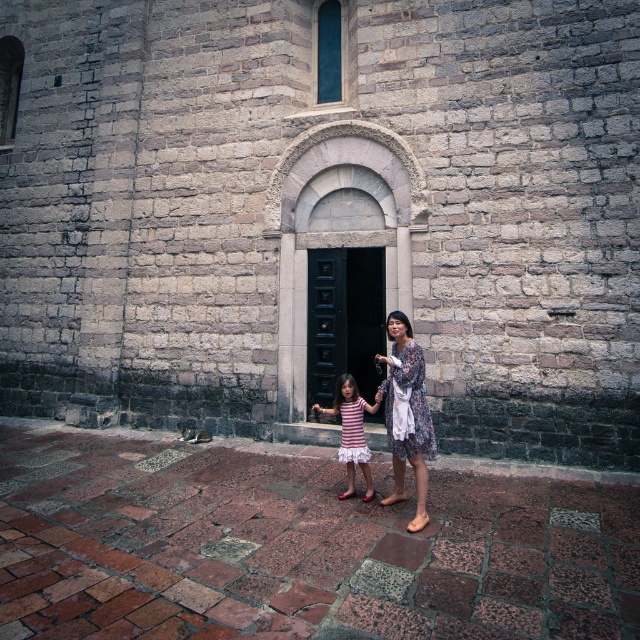
You are standing at the historic stone building and want to move from point A to point B. Point A is at coordinates point (17, 413) and point B is at point (308, 384). Which point is closer to the arched doorway?

Point (308, 384) is closer to the arched doorway because it is in front of point (17, 413).

You are standing at point A, which is located at coordinates (323, 209). You want to walk towards the gray stone church at center. In which direction should you move?

The gray stone church at center is located directly at your current position, so you are already at the gray stone church at center.

You are a photographer positioned in front of the historic stone building. You want to take a photo that includes both the black wooden door at center and the floral dress at center. Which object should you focus on first to ensure both are in sharp focus?

The black wooden door at center is further to the viewer than the floral dress at center, so you should focus on the black wooden door at center first to ensure both are in sharp focus.